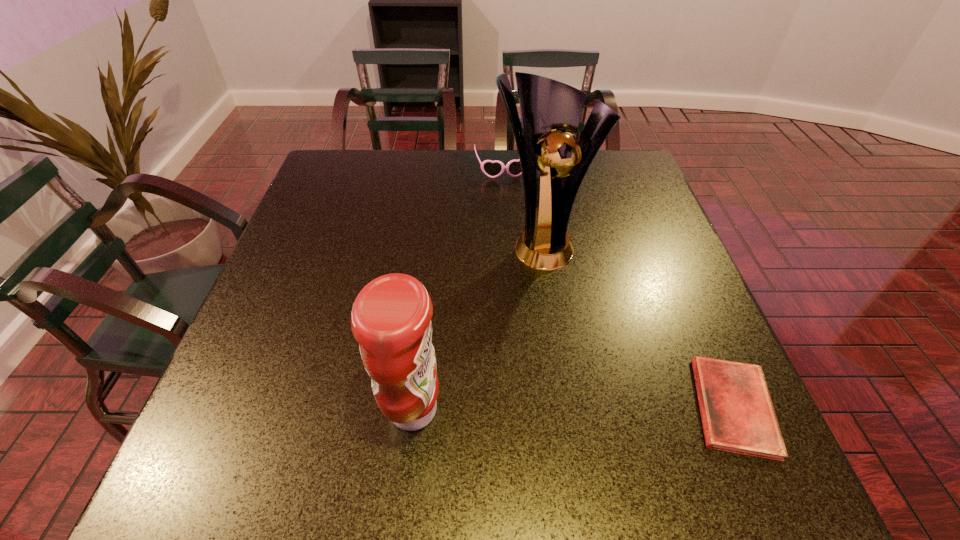
The width and height of the screenshot is (960, 540). In order to click on vacant space that satisfies the following two spatial constraints: 1. on the back side of the tallest object; 2. on the right side of the leftmost object in this screenshot , I will do `click(432, 242)`.

Where is `vacant point that satisfies the following two spatial constraints: 1. on the back side of the farthest object; 2. on the left side of the leftmost object`? Image resolution: width=960 pixels, height=540 pixels. vacant point that satisfies the following two spatial constraints: 1. on the back side of the farthest object; 2. on the left side of the leftmost object is located at coordinates (441, 169).